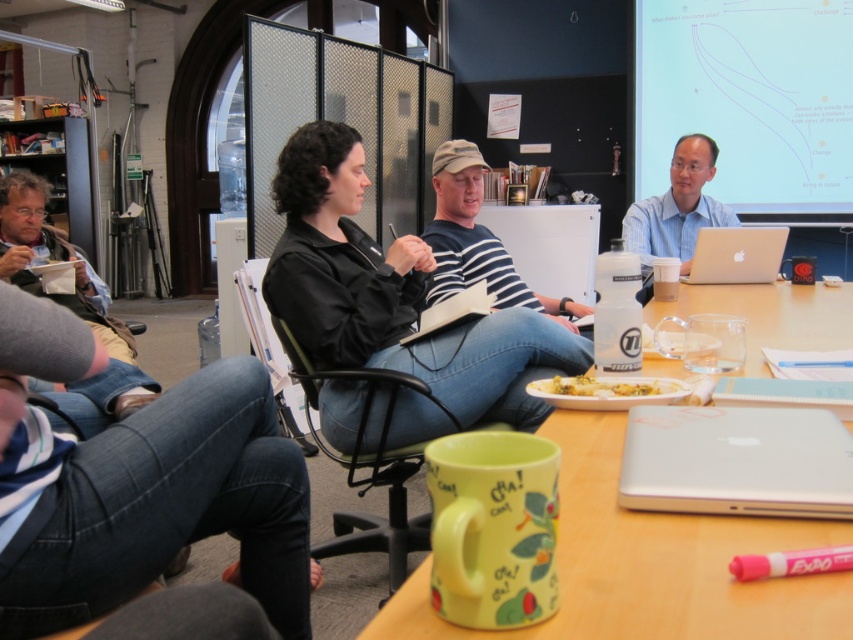
In the scene shown: Does black leather jacket at center lie behind white matte projection screen at upper right?

No.

Between black leather jacket at center and white matte projection screen at upper right, which one appears on the left side from the viewer's perspective?

From the viewer's perspective, black leather jacket at center appears more on the left side.

Between point (404, 337) and point (650, 109), which one is positioned behind?

The point (650, 109) is more distant.

This screenshot has height=640, width=853. What are the coordinates of `black leather jacket at center` in the screenshot? It's located at (393, 294).

Between point (656, 19) and point (463, 269), which one is positioned in front?

Positioned in front is point (463, 269).

Can you confirm if white matte projection screen at upper right is taller than striped cotton shirt at center?

Indeed, white matte projection screen at upper right has a greater height compared to striped cotton shirt at center.

Is point (822, 192) farther from viewer compared to point (473, 212)?

Yes.

At what (x,y) coordinates should I click in order to perform the action: click on white matte projection screen at upper right. Please return your answer as a coordinate pair (x, y). Looking at the image, I should click on (747, 97).

What do you see at coordinates (648, 563) in the screenshot?
I see `yellow ceramic mug at center` at bounding box center [648, 563].

Is yellow ceramic mug at center below black plastic chair at center?

No, yellow ceramic mug at center is not below black plastic chair at center.

At what (x,y) coordinates should I click in order to perform the action: click on yellow ceramic mug at center. Please return your answer as a coordinate pair (x, y). Looking at the image, I should click on (648, 563).